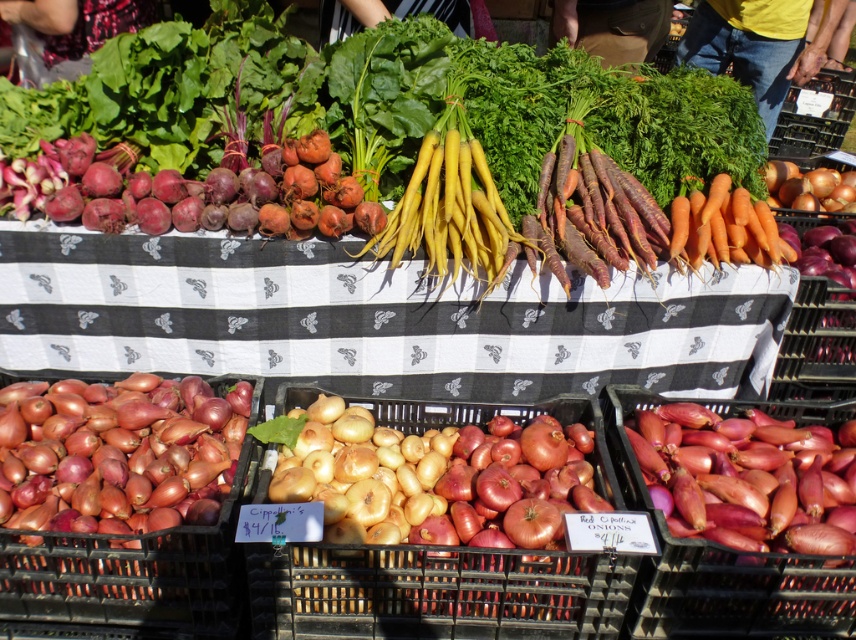
The height and width of the screenshot is (640, 856). What are the coordinates of `purple matte beets at left` in the screenshot? It's located at (188, 193).

Is purple matte beets at left below orange matte carrots at upper right?

No, purple matte beets at left is not below orange matte carrots at upper right.

Where is `purple matte beets at left`? This screenshot has height=640, width=856. purple matte beets at left is located at coordinates tap(188, 193).

Is yellow wax beans at center behind purple matte beets at left?

Yes, yellow wax beans at center is further from the viewer.

Is yellow wax beans at center above purple matte beets at left?

Yes, yellow wax beans at center is above purple matte beets at left.

Is point (438, 93) behind point (119, 164)?

Yes, point (438, 93) is farther from viewer.

Locate an element on the screen. The width and height of the screenshot is (856, 640). yellow wax beans at center is located at coordinates (390, 100).

Which is behind, point (625, 129) or point (753, 253)?

The point (625, 129) is more distant.

Can you confirm if yellow wax beans at center is shorter than orange matte carrots at upper right?

No, yellow wax beans at center is not shorter than orange matte carrots at upper right.

What do you see at coordinates (390, 100) in the screenshot?
I see `yellow wax beans at center` at bounding box center [390, 100].

Find the location of a particular element. This screenshot has height=640, width=856. yellow wax beans at center is located at coordinates (390, 100).